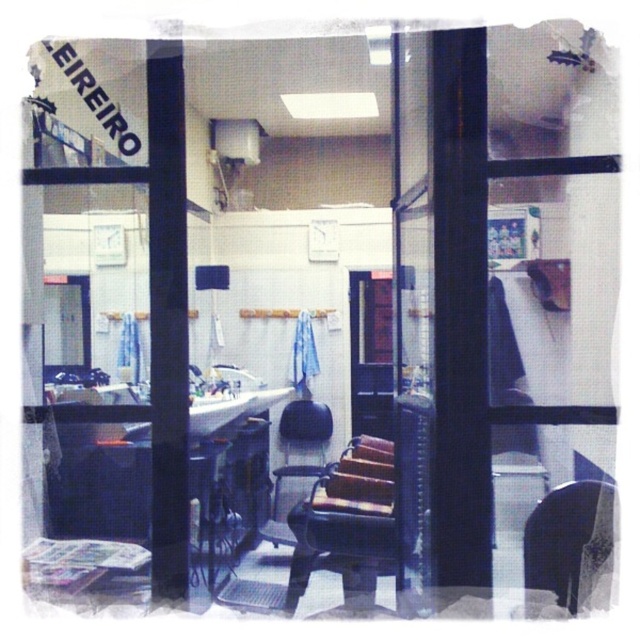
You are a customer looking for a chair to sit in the salon. The metallic black chair at center and the black leather chair at lower right are available. Which chair is larger?

The metallic black chair at center is bigger than the black leather chair at lower right.

You are standing in the hair salon named EIREIRO. You need to sit on the metallic black chair at center. Which direction should you walk towards from your current position?

Walk towards the center of the salon to reach the metallic black chair at center.

You are a customer entering the salon and want to sit in the black leather chair at center. There is a black leather chair at lower right nearby. How far apart are these two chairs?

The black leather chair at lower right is 62.48 centimeters away from the black leather chair at center.